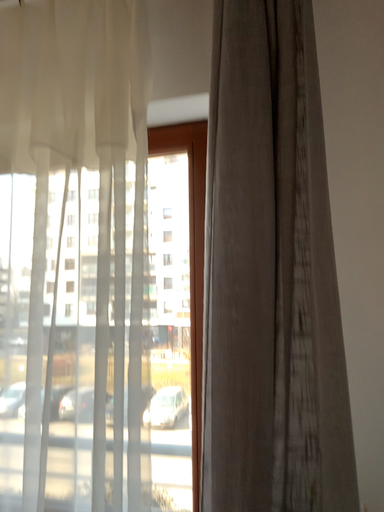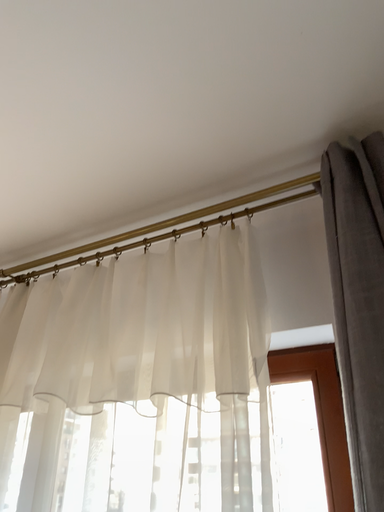
Question: How did the camera likely rotate when shooting the video?

Choices:
 (A) rotated right
 (B) rotated left

Answer: (B)